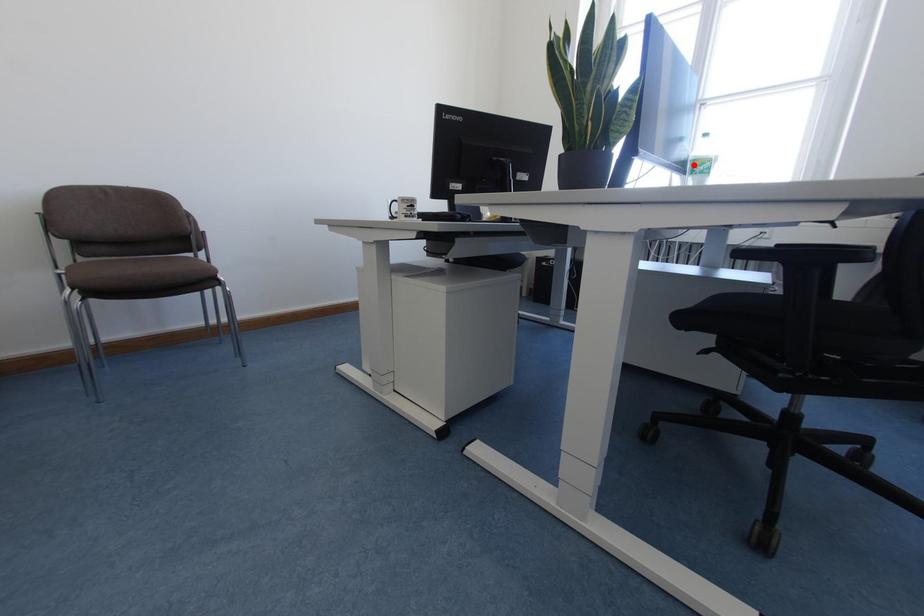
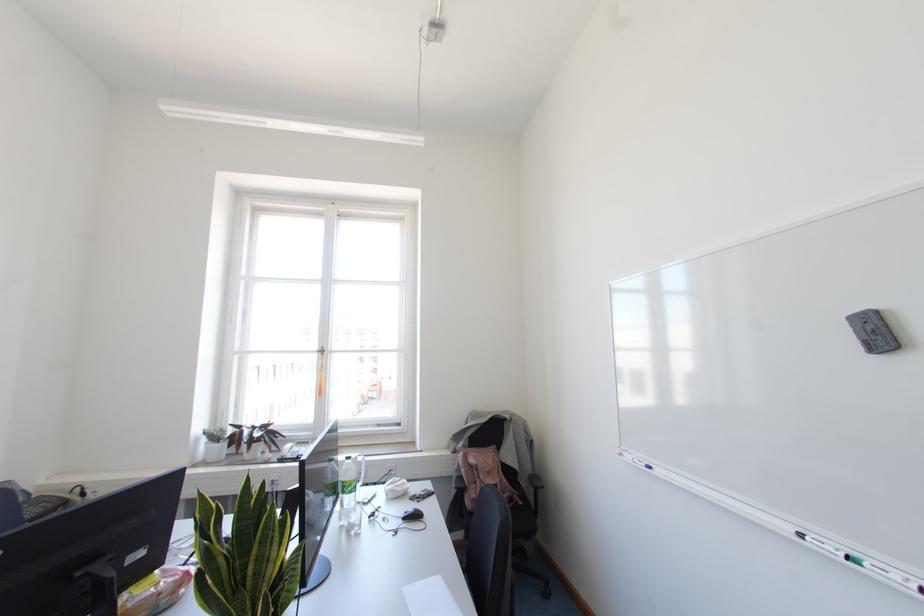
Question: A red point is marked in image1. In image2, is the corresponding 3D point closer to the camera or farther? Reply with the corresponding letter.

Choices:
 (A) The corresponding 3D point is closer.
 (B) The corresponding 3D point is farther.

Answer: (A)